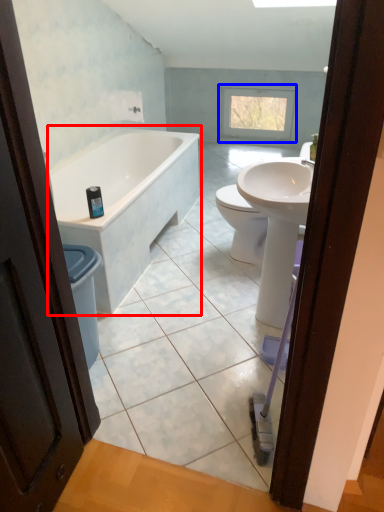
Question: Which of the following is the closest to the observer, bathtub (highlighted by a red box) or window (highlighted by a blue box)?

Choices:
 (A) bathtub
 (B) window

Answer: (A)